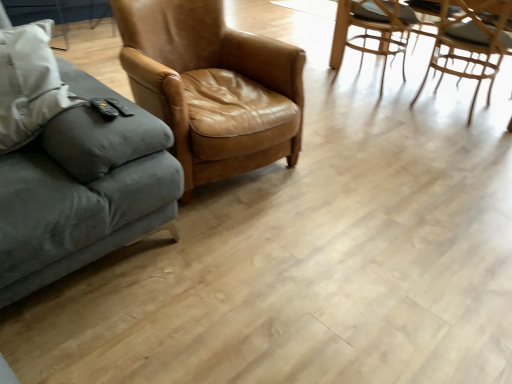
The image size is (512, 384). What are the coordinates of `vacant space to the right of brown leather chair at center, the 1th chair positioned from the left` in the screenshot? It's located at (x=357, y=166).